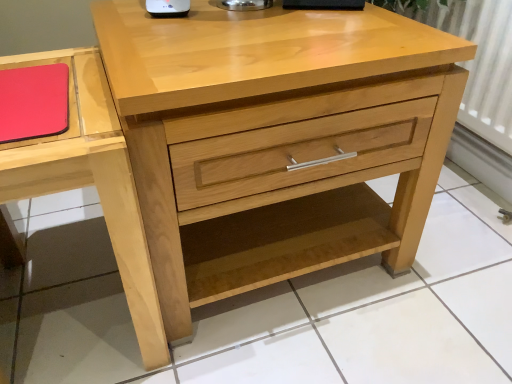
Question: Does point (76, 125) appear closer or farther from the camera than point (45, 67)?

Choices:
 (A) closer
 (B) farther

Answer: (A)

Question: Would you say matte wood vanity at left is to the left or to the right of rubberized matte red notepad at upper left in the picture?

Choices:
 (A) right
 (B) left

Answer: (B)

Question: Considering the real-world distances, which object is farthest from the natural wood chest of drawers at center?

Choices:
 (A) rubberized matte red notepad at upper left
 (B) matte wood vanity at left

Answer: (A)

Question: Considering the real-world distances, which object is closest to the rubberized matte red notepad at upper left?

Choices:
 (A) matte wood vanity at left
 (B) natural wood chest of drawers at center

Answer: (A)